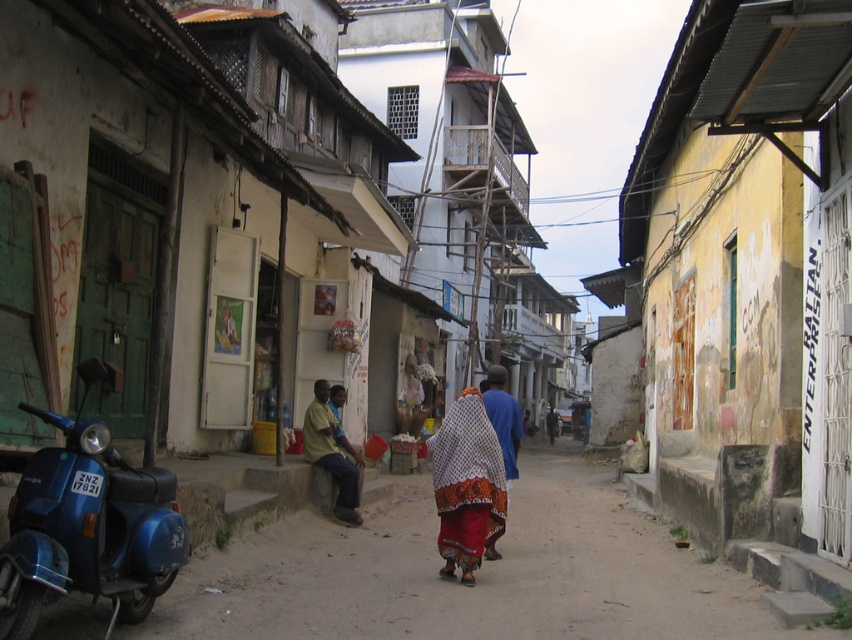
Is white printed fabric at center above yellow cotton shirt at center?

Yes.

This screenshot has height=640, width=852. Identify the location of white printed fabric at center. (465, 484).

Who is higher up, metallic blue scooter at left or yellow cotton shirt at center?

metallic blue scooter at left

Locate an element on the screen. metallic blue scooter at left is located at coordinates (88, 524).

Is yellow cotton shirt at center smaller than orange printed fabric at center?

Indeed, yellow cotton shirt at center has a smaller size compared to orange printed fabric at center.

Between yellow cotton shirt at center and orange printed fabric at center, which one has more height?

orange printed fabric at center is taller.

Is point (327, 387) farther from camera compared to point (499, 428)?

Yes, point (327, 387) is behind point (499, 428).

The width and height of the screenshot is (852, 640). What are the coordinates of `yellow cotton shirt at center` in the screenshot? It's located at (330, 452).